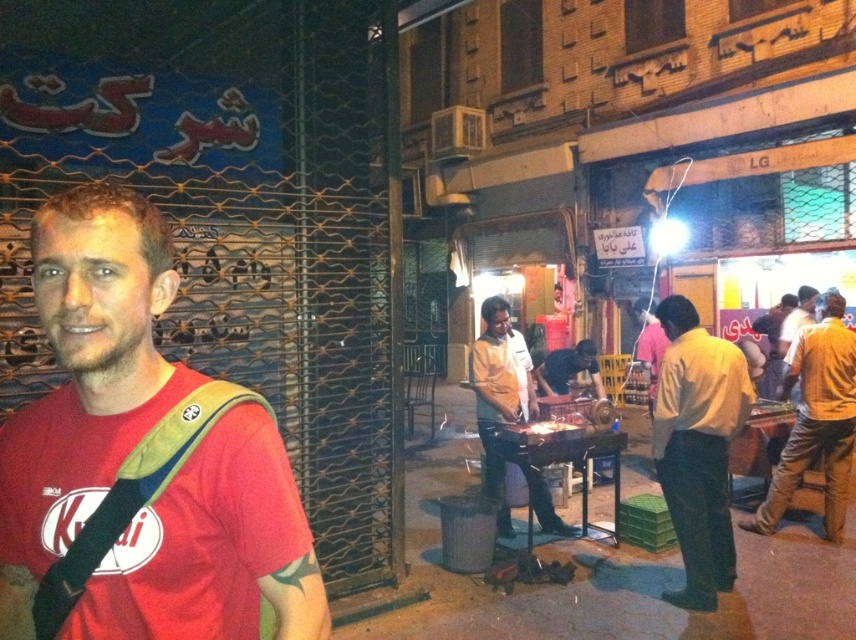
Question: Can you confirm if red matte shirt at center is wider than yellow cotton shirt at right?

Choices:
 (A) yes
 (B) no

Answer: (B)

Question: In this image, where is red matte shirt at center located relative to yellow shirt at center?

Choices:
 (A) left
 (B) right

Answer: (A)

Question: Does red matte shirt at center have a lesser width compared to yellow cotton shirt at right?

Choices:
 (A) no
 (B) yes

Answer: (B)

Question: Which point is closer to the camera?

Choices:
 (A) yellow cotton shirt at right
 (B) light brown shirt at center
 (C) yellow shirt at center

Answer: (C)

Question: Which object appears farthest from the camera in this image?

Choices:
 (A) red matte shirt at center
 (B) yellow shirt at center
 (C) light brown shirt at center
 (D) yellow cotton shirt at right

Answer: (D)

Question: Which of these objects is positioned farthest from the yellow shirt at center?

Choices:
 (A) yellow cotton shirt at right
 (B) red matte shirt at center
 (C) light brown shirt at center

Answer: (B)